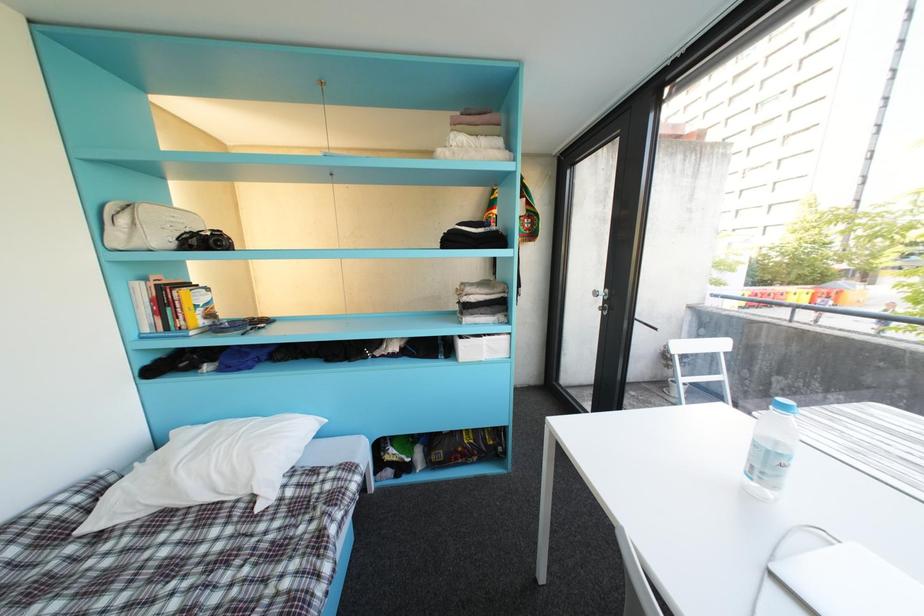
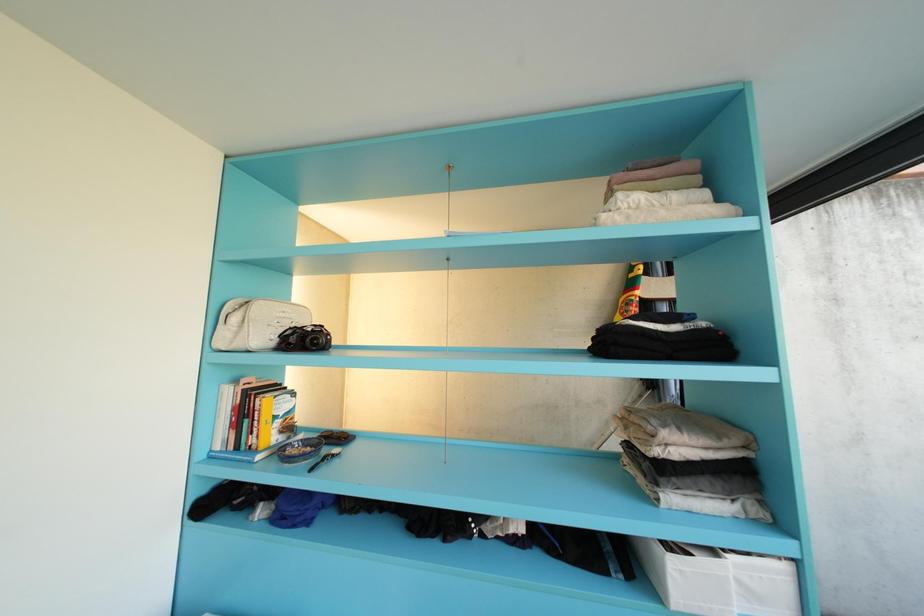
The images are taken continuously from a first-person perspective. In which direction is your viewpoint rotating?

The camera's rotation is toward left-up.